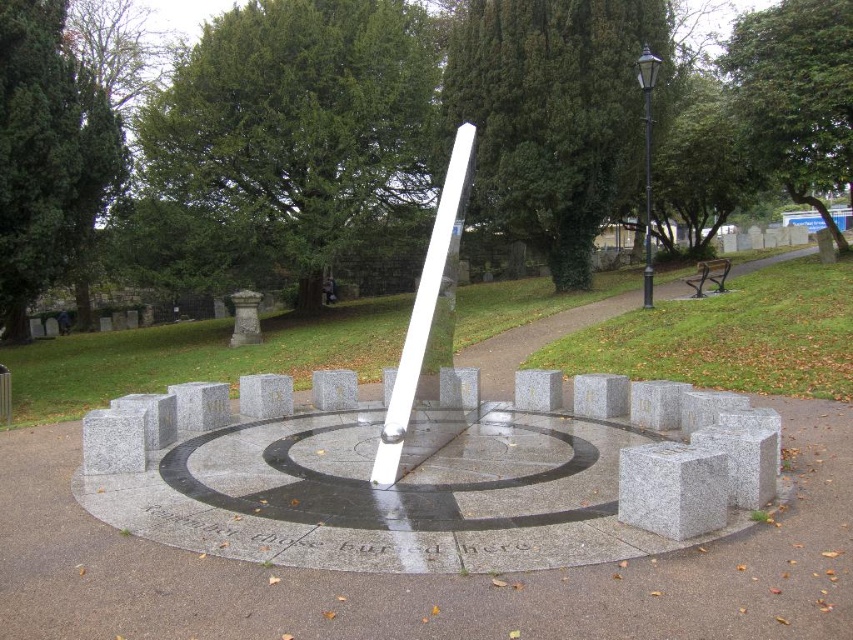
Question: Considering the relative positions of gray granite cube at lower right and white polished stone candle at center in the image provided, where is gray granite cube at lower right located with respect to white polished stone candle at center?

Choices:
 (A) right
 (B) left

Answer: (A)

Question: Which point appears closest to the camera in this image?

Choices:
 (A) pyautogui.click(x=376, y=474)
 (B) pyautogui.click(x=625, y=499)

Answer: (B)

Question: Which point is farther to the camera?

Choices:
 (A) white polished stone candle at center
 (B) gray granite cube at lower right

Answer: (A)

Question: Does gray granite cube at lower right come behind white polished stone candle at center?

Choices:
 (A) no
 (B) yes

Answer: (A)

Question: Which object appears farthest from the camera in this image?

Choices:
 (A) gray granite cube at lower right
 (B) white polished stone candle at center

Answer: (B)

Question: Is gray granite cube at lower right bigger than white polished stone candle at center?

Choices:
 (A) no
 (B) yes

Answer: (A)